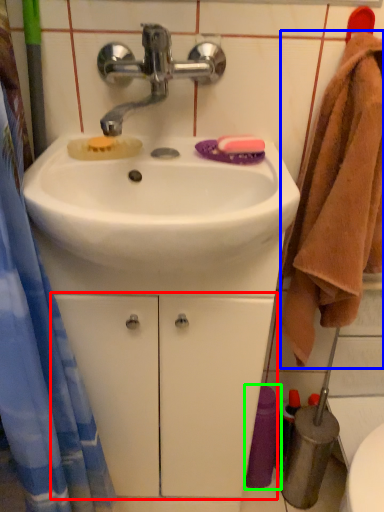
Question: Based on their relative distances, which object is nearer to drawer (highlighted by a red box)? Choose from bath towel (highlighted by a blue box) and toiletry (highlighted by a green box).

Choices:
 (A) bath towel
 (B) toiletry

Answer: (B)